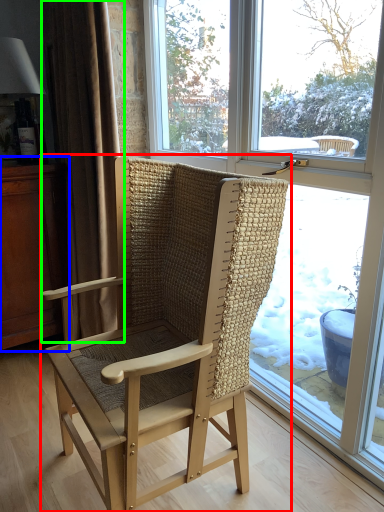
Question: Based on their relative distances, which object is farther from chair (highlighted by a red box)? Choose from dresser (highlighted by a blue box) and curtain (highlighted by a green box).

Choices:
 (A) dresser
 (B) curtain

Answer: (A)